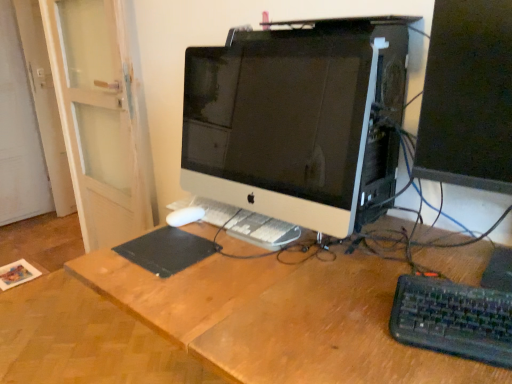
What do you see at coordinates (298, 120) in the screenshot? The height and width of the screenshot is (384, 512). I see `white glossy computer monitor at center, the first computer monitor viewed from the left` at bounding box center [298, 120].

Where is `black plastic keyboard at lower right`? The width and height of the screenshot is (512, 384). black plastic keyboard at lower right is located at coordinates (453, 319).

This screenshot has height=384, width=512. What do you see at coordinates (453, 319) in the screenshot?
I see `black plastic keyboard at lower right` at bounding box center [453, 319].

Where is `wooden desk at center`? The height and width of the screenshot is (384, 512). wooden desk at center is located at coordinates (281, 319).

I want to click on white glossy computer monitor at center, the first computer monitor viewed from the left, so click(298, 120).

From a real-world perspective, relative to black plastic keyboard at lower right, is white glossy computer monitor at center, the first computer monitor viewed from the left, vertically above or below?

white glossy computer monitor at center, the first computer monitor viewed from the left, is situated higher than black plastic keyboard at lower right in the real world.

Considering the sizes of objects white glossy computer monitor at center, the first computer monitor viewed from the left, and black plastic keyboard at lower right in the image provided, who is thinner, white glossy computer monitor at center, the first computer monitor viewed from the left, or black plastic keyboard at lower right?

white glossy computer monitor at center, the first computer monitor viewed from the left, is thinner.

Could you measure the distance between white glossy computer monitor at center, which is counted as the 2th computer monitor, starting from the right, and black plastic keyboard at lower right?

They are 17.08 inches apart.

This screenshot has width=512, height=384. I want to click on computer keyboard lying below the white glossy computer monitor at center, which is counted as the 2th computer monitor, starting from the right (from the image's perspective), so click(453, 319).

Is white plastic keyboard at center not close to matte black monitor at right, the 2th computer monitor from the left?

No, white plastic keyboard at center is not far from matte black monitor at right, the 2th computer monitor from the left.

In terms of size, does white plastic keyboard at center appear bigger or smaller than matte black monitor at right, which is counted as the first computer monitor, starting from the right?

Clearly, white plastic keyboard at center is smaller in size than matte black monitor at right, which is counted as the first computer monitor, starting from the right.

Considering the relative positions of white plastic keyboard at center and matte black monitor at right, the 2th computer monitor from the left, in the image provided, is white plastic keyboard at center to the left or to the right of matte black monitor at right, the 2th computer monitor from the left,?

white plastic keyboard at center is to the left of matte black monitor at right, the 2th computer monitor from the left.

From a real-world perspective, is white plastic keyboard at center positioned over matte black monitor at right, which is counted as the first computer monitor, starting from the right, based on gravity?

No, from a real-world perspective, white plastic keyboard at center is not on top of matte black monitor at right, which is counted as the first computer monitor, starting from the right.

Is matte black monitor at right, which is counted as the first computer monitor, starting from the right, at the right side of black plastic keyboard at lower right?

Indeed, matte black monitor at right, which is counted as the first computer monitor, starting from the right, is positioned on the right side of black plastic keyboard at lower right.

Image resolution: width=512 pixels, height=384 pixels. In the image, there is a matte black monitor at right, which is counted as the first computer monitor, starting from the right. Find the location of `computer keyboard below it (from the image's perspective)`. computer keyboard below it (from the image's perspective) is located at coordinates (453, 319).

Between matte black monitor at right, the 2th computer monitor from the left, and black plastic keyboard at lower right, which one has smaller width?

With smaller width is black plastic keyboard at lower right.

Is matte black monitor at right, the 2th computer monitor from the left, in contact with black plastic keyboard at lower right?

matte black monitor at right, the 2th computer monitor from the left, and black plastic keyboard at lower right are clearly separated.

Does white glossy computer monitor at center, which is counted as the 2th computer monitor, starting from the right, appear on the right side of wooden desk at center?

In fact, white glossy computer monitor at center, which is counted as the 2th computer monitor, starting from the right, is to the left of wooden desk at center.

Does point (405, 39) lie behind point (205, 278)?

Yes.

From a real-world perspective, is white glossy computer monitor at center, the first computer monitor viewed from the left, positioned above or below wooden desk at center?

From a real-world perspective, white glossy computer monitor at center, the first computer monitor viewed from the left, is physically above wooden desk at center.

In the scene shown: Is the surface of black matte mousepad at center in direct contact with white plastic keyboard at center?

black matte mousepad at center and white plastic keyboard at center are not in contact.

Is black matte mousepad at center situated inside white plastic keyboard at center or outside?

black matte mousepad at center lies outside white plastic keyboard at center.

From a real-world perspective, relative to white plastic keyboard at center, is black matte mousepad at center vertically above or below?

From a real-world perspective, black matte mousepad at center is physically below white plastic keyboard at center.

Considering the positions of objects black matte mousepad at center and white plastic keyboard at center in the image provided, who is more to the right, black matte mousepad at center or white plastic keyboard at center?

Positioned to the right is white plastic keyboard at center.

Between matte black monitor at right, which is counted as the first computer monitor, starting from the right, and white plastic keyboard at center, which one appears on the left side from the viewer's perspective?

white plastic keyboard at center.

Considering the positions of point (478, 79) and point (297, 226), is point (478, 79) closer or farther from the camera than point (297, 226)?

Point (478, 79).

Is matte black monitor at right, which is counted as the first computer monitor, starting from the right, further to camera compared to white plastic keyboard at center?

That is False.

In the scene shown: Is matte black monitor at right, the 2th computer monitor from the left, facing towards white plastic keyboard at center?

No, matte black monitor at right, the 2th computer monitor from the left, is not oriented towards white plastic keyboard at center.

Where is `desk below the matte black monitor at right, the 2th computer monitor from the left (from a real-world perspective)`? The width and height of the screenshot is (512, 384). desk below the matte black monitor at right, the 2th computer monitor from the left (from a real-world perspective) is located at coordinates (281, 319).

In the image, is matte black monitor at right, which is counted as the first computer monitor, starting from the right, on the left side or the right side of wooden desk at center?

Based on their positions, matte black monitor at right, which is counted as the first computer monitor, starting from the right, is located to the right of wooden desk at center.

Considering the sizes of objects matte black monitor at right, which is counted as the first computer monitor, starting from the right, and wooden desk at center in the image provided, who is bigger, matte black monitor at right, which is counted as the first computer monitor, starting from the right, or wooden desk at center?

With larger size is wooden desk at center.

Where is `computer keyboard below the white glossy computer monitor at center, which is counted as the 2th computer monitor, starting from the right (from the image's perspective)`? Image resolution: width=512 pixels, height=384 pixels. computer keyboard below the white glossy computer monitor at center, which is counted as the 2th computer monitor, starting from the right (from the image's perspective) is located at coordinates (453, 319).

Identify the location of the 2nd computer monitor to the right when counting from the white plastic keyboard at center. The width and height of the screenshot is (512, 384). (468, 97).

Looking at the image, which one is located closer to white glossy computer monitor at center, which is counted as the 2th computer monitor, starting from the right, white plastic keyboard at center or wooden desk at center?

The object closer to white glossy computer monitor at center, which is counted as the 2th computer monitor, starting from the right, is white plastic keyboard at center.

When comparing their distances from matte black monitor at right, the 2th computer monitor from the left, does wooden desk at center or black matte mousepad at center seem further?

black matte mousepad at center lies further to matte black monitor at right, the 2th computer monitor from the left, than the other object.

Based on their spatial positions, is white glossy computer monitor at center, which is counted as the 2th computer monitor, starting from the right, or black plastic keyboard at lower right further from wooden desk at center?

Among the two, white glossy computer monitor at center, which is counted as the 2th computer monitor, starting from the right, is located further to wooden desk at center.

Estimate the real-world distances between objects in this image. Which object is closer to wooden desk at center, black matte mousepad at center or matte black monitor at right, the 2th computer monitor from the left?

black matte mousepad at center is positioned closer to the anchor wooden desk at center.

From the image, which object appears to be farther from matte black monitor at right, the 2th computer monitor from the left, black matte mousepad at center or wooden desk at center?

Based on the image, black matte mousepad at center appears to be further to matte black monitor at right, the 2th computer monitor from the left.

Looking at the image, which one is located further to black matte mousepad at center, white plastic keyboard at center or black plastic keyboard at lower right?

black plastic keyboard at lower right lies further to black matte mousepad at center than the other object.

When comparing their distances from black matte mousepad at center, does matte black monitor at right, which is counted as the first computer monitor, starting from the right, or white glossy computer monitor at center, the first computer monitor viewed from the left, seem closer?

Among the two, white glossy computer monitor at center, the first computer monitor viewed from the left, is located nearer to black matte mousepad at center.

From the image, which object appears to be farther from white plastic keyboard at center, wooden desk at center or matte black monitor at right, the 2th computer monitor from the left?

The object further to white plastic keyboard at center is matte black monitor at right, the 2th computer monitor from the left.

Where is `laptop keyboard between black matte mousepad at center and black plastic keyboard at lower right in the horizontal direction`? The height and width of the screenshot is (384, 512). laptop keyboard between black matte mousepad at center and black plastic keyboard at lower right in the horizontal direction is located at coordinates (244, 223).

Image resolution: width=512 pixels, height=384 pixels. I want to click on computer keyboard between white glossy computer monitor at center, which is counted as the 2th computer monitor, starting from the right, and wooden desk at center vertically, so click(x=453, y=319).

The width and height of the screenshot is (512, 384). What are the coordinates of `laptop keyboard that lies between matte black monitor at right, the 2th computer monitor from the left, and wooden desk at center from top to bottom` in the screenshot? It's located at (244, 223).

You are a GUI agent. You are given a task and a screenshot of the screen. Output one action in this format:
    pyautogui.click(x=<x>, y=<y>)
    Task: Click on the computer keyboard between white glossy computer monitor at center, which is counted as the 2th computer monitor, starting from the right, and matte black monitor at right, which is counted as the first computer monitor, starting from the right
    
    Given the screenshot: What is the action you would take?
    pyautogui.click(x=453, y=319)